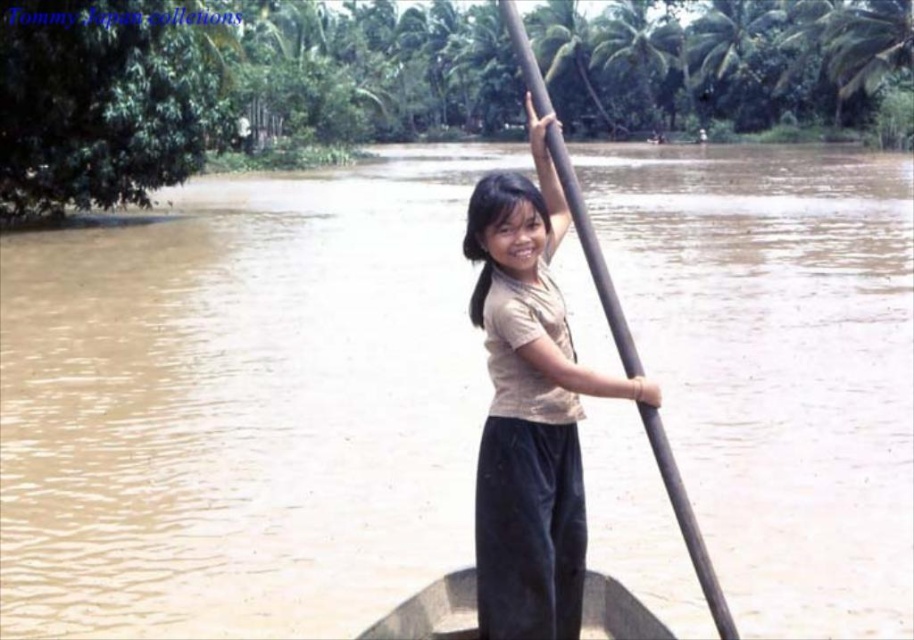
Does matte brown shirt at center appear over dark brown wood canoe at center?

Yes.

Is matte brown shirt at center thinner than dark brown wood canoe at center?

In fact, matte brown shirt at center might be wider than dark brown wood canoe at center.

Measure the distance between matte brown shirt at center and camera.

A distance of 20.93 feet exists between matte brown shirt at center and camera.

The width and height of the screenshot is (914, 640). In order to click on matte brown shirt at center in this screenshot , I will do `click(529, 406)`.